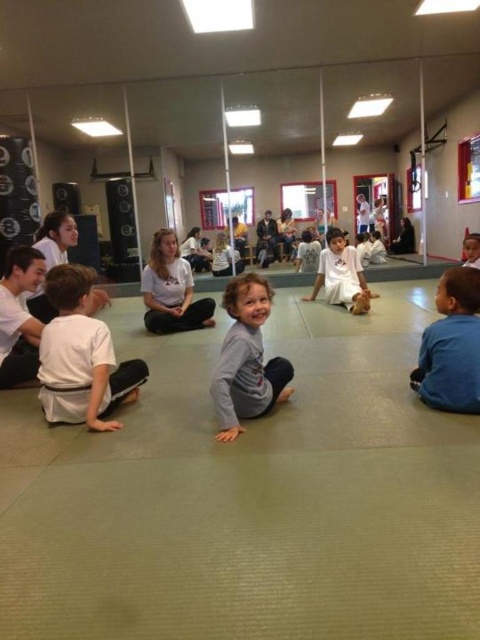
You are a new student entering the dojo and see the white karate uniform at lower left and the white cotton pants at center. Which piece of clothing is closer to the front of the scene?

The white karate uniform at lower left is positioned under the white cotton pants at center, meaning it is closer to the front of the scene.

You are a photographer standing at the entrance of the dojo. You want to take a picture of the blue cotton shirt at lower right and the white cotton shirt at center. Can you fit both in the frame if your camera has a 5 feet wide angle?

The blue cotton shirt at lower right is 8.58 feet away from the white cotton shirt at center. Since the distance between them exceeds the 5 feet wide angle of the camera, you cannot fit both in the frame.